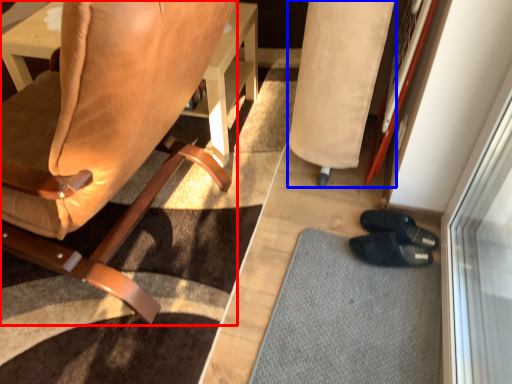
Question: Which point is further to the camera, chair (highlighted by a red box) or bean bag chair (highlighted by a blue box)?

Choices:
 (A) chair
 (B) bean bag chair

Answer: (B)